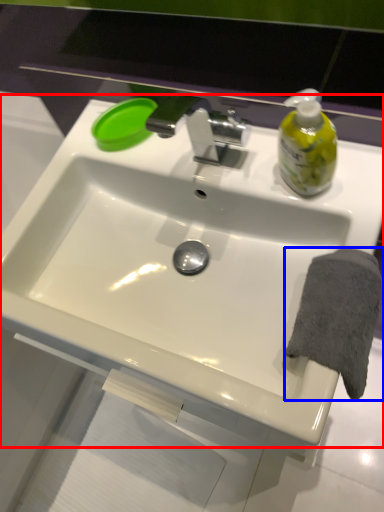
Question: Among these objects, which one is farthest to the camera, sink (highlighted by a red box) or bath towel (highlighted by a blue box)?

Choices:
 (A) sink
 (B) bath towel

Answer: (B)